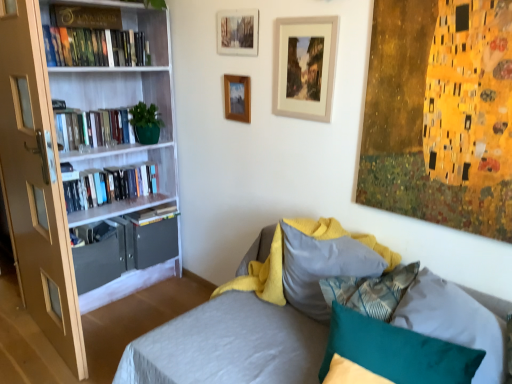
This screenshot has height=384, width=512. In order to click on free spot below matte beige door at left (from a real-world perspective) in this screenshot , I will do `click(44, 345)`.